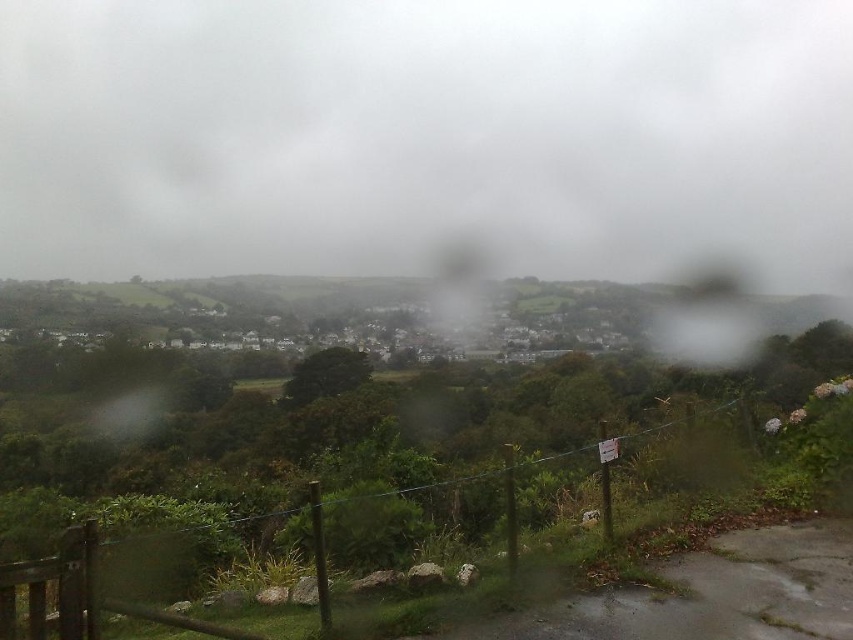
Is white fluffy cloud at upper center shorter than wooden fence at lower center?

In fact, white fluffy cloud at upper center may be taller than wooden fence at lower center.

Does point (775, 10) lie in front of point (729, 403)?

That is False.

Find the location of `white fluffy cloud at upper center`. white fluffy cloud at upper center is located at coordinates (427, 138).